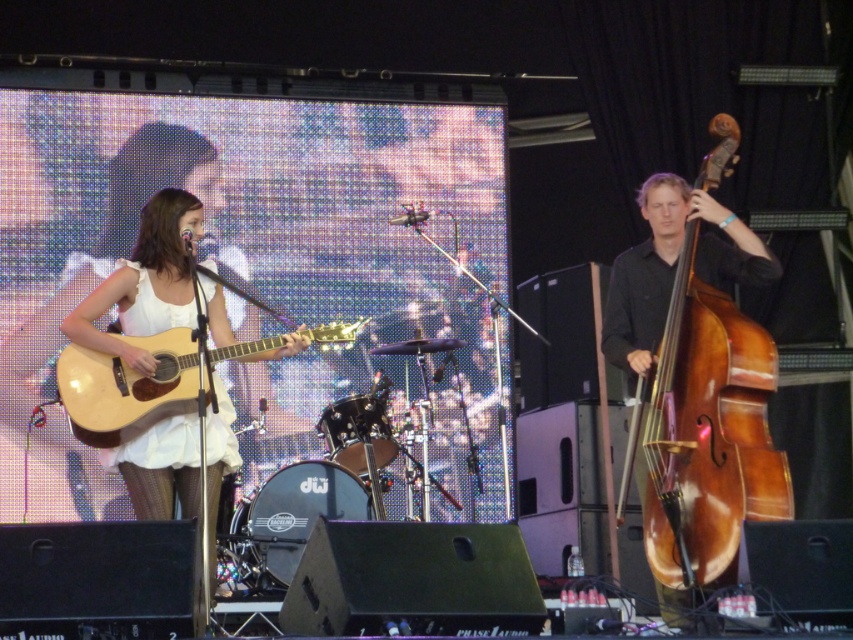
You are a stagehand preparing to move the brown wooden cello at right and the matte white dress at center. Which object will require less space to transport?

The brown wooden cello at right has a smaller size compared to matte white dress at center, so it will require less space to transport.

You are a photographer trying to capture the best angle of the stage. You notice two points on the stage marked as point (759, 330) and point (177, 195). Which point should you focus on to ensure it appears larger in your photo?

Point (759, 330) should be focused on because it is closer to the camera and will appear larger in the photo compared to point (177, 195) which is farther away.